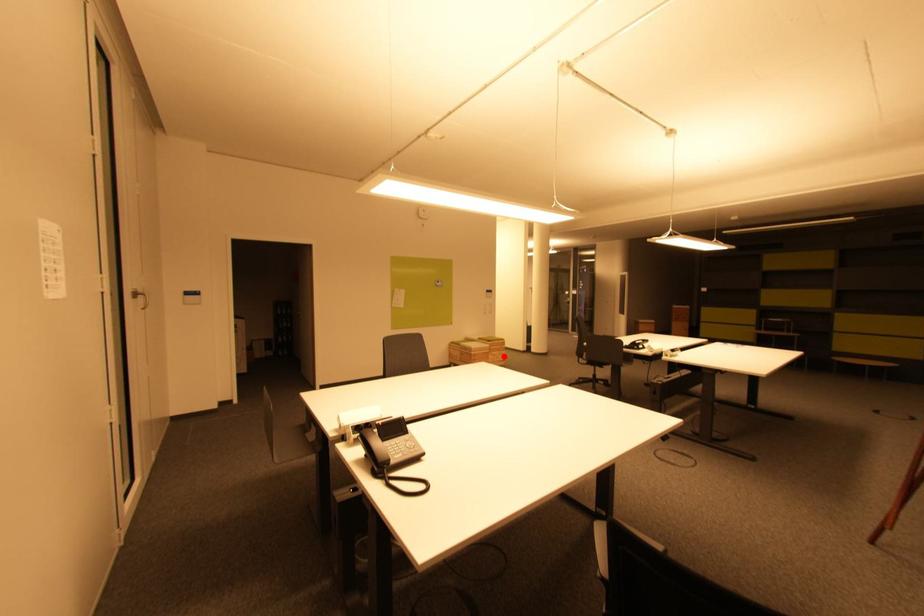
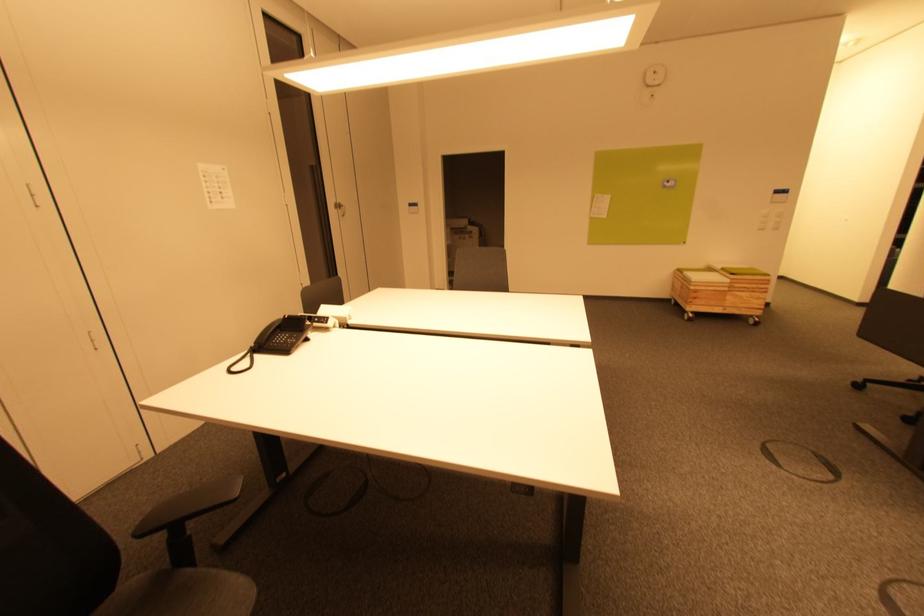
Question: I am providing you with two images of the same scene from different viewpoints. In image1, a red point is highlighted. Considering the same 3D point in image2, which of the following is correct?

Choices:
 (A) It is closer
 (B) It is farther

Answer: (A)